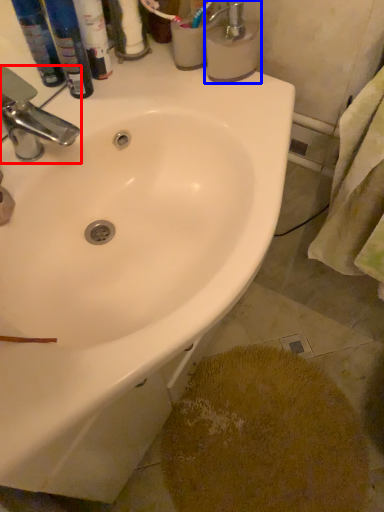
Question: Which point is further to the camera, tap (highlighted by a red box) or soap dispenser (highlighted by a blue box)?

Choices:
 (A) tap
 (B) soap dispenser

Answer: (B)